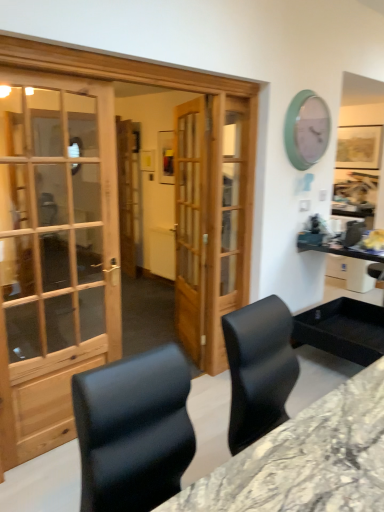
Question: Does teal plastic clock at upper right appear on the left side of marble/black desk at center?

Choices:
 (A) no
 (B) yes

Answer: (A)

Question: Is marble/black desk at center inside teal plastic clock at upper right?

Choices:
 (A) no
 (B) yes

Answer: (A)

Question: Does teal plastic clock at upper right have a greater height compared to marble/black desk at center?

Choices:
 (A) yes
 (B) no

Answer: (B)

Question: Can you confirm if teal plastic clock at upper right is wider than marble/black desk at center?

Choices:
 (A) yes
 (B) no

Answer: (B)

Question: Is teal plastic clock at upper right to the right of marble/black desk at center from the viewer's perspective?

Choices:
 (A) yes
 (B) no

Answer: (A)

Question: Is teal plastic clock at upper right inside the boundaries of wooden door at center, or outside?

Choices:
 (A) outside
 (B) inside

Answer: (A)

Question: Considering their positions, is teal plastic clock at upper right located in front of or behind wooden door at center?

Choices:
 (A) behind
 (B) front

Answer: (A)

Question: From the image's perspective, relative to wooden door at center, is teal plastic clock at upper right above or below?

Choices:
 (A) below
 (B) above

Answer: (B)

Question: Is point (306, 105) positioned closer to the camera than point (182, 330)?

Choices:
 (A) closer
 (B) farther

Answer: (A)

Question: In terms of height, does wooden door at center look taller or shorter compared to teal plastic clock at upper right?

Choices:
 (A) tall
 (B) short

Answer: (A)

Question: From the image's perspective, is wooden door at center above or below teal plastic clock at upper right?

Choices:
 (A) above
 (B) below

Answer: (B)

Question: Do you think wooden door at center is within teal plastic clock at upper right, or outside of it?

Choices:
 (A) inside
 (B) outside

Answer: (B)

Question: Looking at the image, does wooden door at center seem bigger or smaller compared to teal plastic clock at upper right?

Choices:
 (A) big
 (B) small

Answer: (A)

Question: Considering the positions of wooden door at center and marble/black desk at center in the image, is wooden door at center taller or shorter than marble/black desk at center?

Choices:
 (A) short
 (B) tall

Answer: (B)

Question: From a real-world perspective, is wooden door at center above or below marble/black desk at center?

Choices:
 (A) above
 (B) below

Answer: (A)